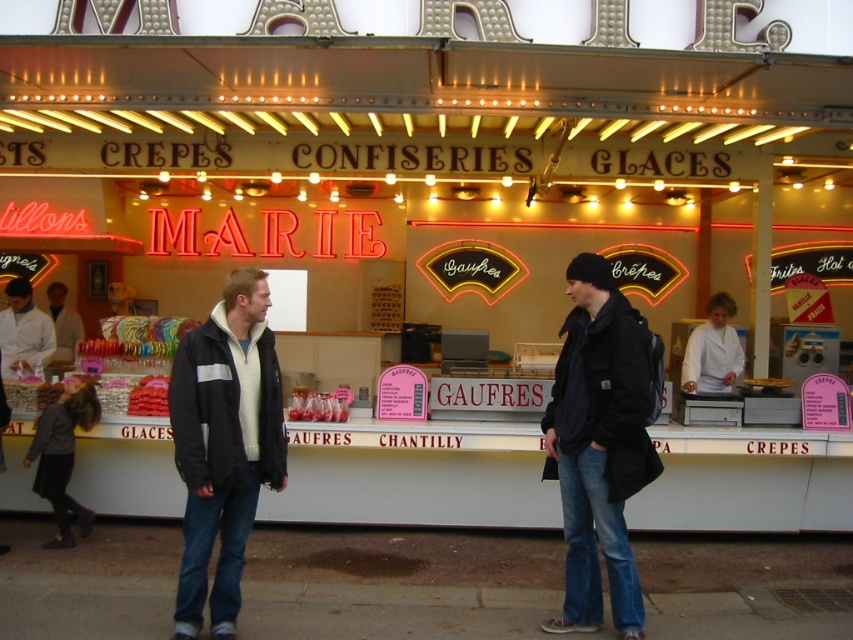
Does white lab coat at left have a lesser height compared to matte plastic gaufre at center?

No.

Is point (7, 358) less distant than point (775, 385)?

No, (7, 358) is behind (775, 385).

You are a GUI agent. You are given a task and a screenshot of the screen. Output one action in this format:
    pyautogui.click(x=<x>, y=<y>)
    Task: Click on the white lab coat at left
    Image resolution: width=853 pixels, height=640 pixels.
    Given the screenshot: What is the action you would take?
    pyautogui.click(x=22, y=332)

Who is positioned more to the right, white lab coat at left or shiny red candy at center?

Positioned to the right is shiny red candy at center.

Looking at this image, is white lab coat at left positioned before shiny red candy at center?

No, it is behind shiny red candy at center.

This screenshot has height=640, width=853. What do you see at coordinates (22, 332) in the screenshot?
I see `white lab coat at left` at bounding box center [22, 332].

The width and height of the screenshot is (853, 640). I want to click on white lab coat at left, so click(x=22, y=332).

Does white lab coat at left lie behind white cotton jacket at center?

No.

Does white lab coat at left have a smaller size compared to white cotton jacket at center?

Correct, white lab coat at left occupies less space than white cotton jacket at center.

Find the location of a particular element. This screenshot has width=853, height=640. white lab coat at left is located at coordinates (22, 332).